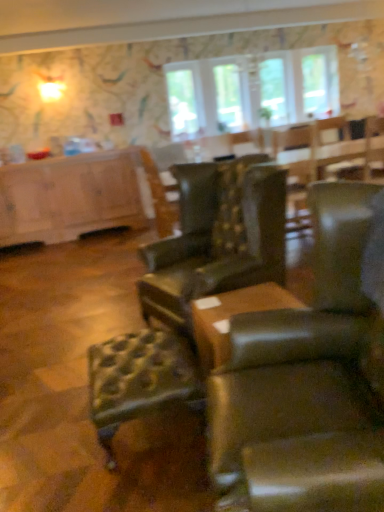
Locate an element on the screen. vacant space situated above brown leather ottoman at center (from a real-world perspective) is located at coordinates (229, 305).